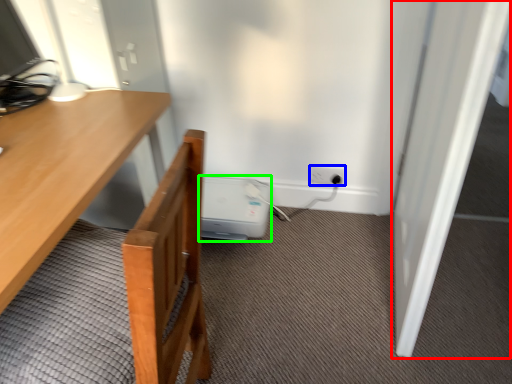
Question: Considering the real-world distances, which object is farthest from door (highlighted by a red box)? electric outlet (highlighted by a blue box) or water heater (highlighted by a green box)?

Choices:
 (A) electric outlet
 (B) water heater

Answer: (B)